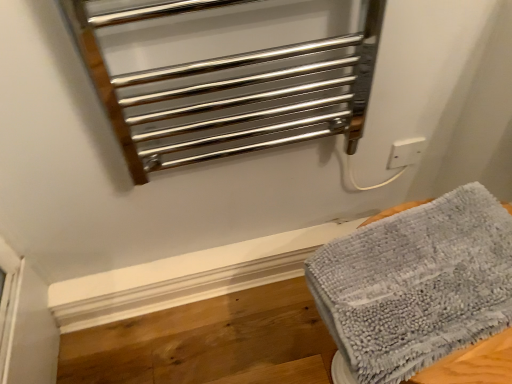
Describe the element at coordinates (406, 152) in the screenshot. I see `white plastic electric outlet at upper right` at that location.

The image size is (512, 384). What are the coordinates of `gray fluffy towel at lower right` in the screenshot? It's located at (416, 284).

From the image's perspective, who appears lower, white plastic electric outlet at upper right or gray fluffy towel at lower right?

gray fluffy towel at lower right, from the image's perspective.

In the scene shown: Which point is more forward, (402, 158) or (402, 235)?

Point (402, 235)

Is white plastic electric outlet at upper right oriented away from gray fluffy towel at lower right?

white plastic electric outlet at upper right is not turned away from gray fluffy towel at lower right.

From a real-world perspective, is white plastic electric outlet at upper right physically located above or below gray fluffy towel at lower right?

white plastic electric outlet at upper right is situated lower than gray fluffy towel at lower right in the real world.

Is gray fluffy towel at lower right to the left of polished metal towel rack at upper center from the viewer's perspective?

In fact, gray fluffy towel at lower right is to the right of polished metal towel rack at upper center.

Between gray fluffy towel at lower right and polished metal towel rack at upper center, which one has larger size?

Bigger between the two is polished metal towel rack at upper center.

How many degrees apart are the facing directions of gray fluffy towel at lower right and polished metal towel rack at upper center?

The angle between the facing direction of gray fluffy towel at lower right and the facing direction of polished metal towel rack at upper center is 84.6 degrees.

Is point (353, 237) more distant than point (209, 126)?

That is False.

From the image's perspective, is gray fluffy towel at lower right above or below white plastic electric outlet at upper right?

gray fluffy towel at lower right is below white plastic electric outlet at upper right.

Consider the image. Can you confirm if gray fluffy towel at lower right is smaller than white plastic electric outlet at upper right?

Incorrect, gray fluffy towel at lower right is not smaller in size than white plastic electric outlet at upper right.

Is gray fluffy towel at lower right positioned beyond the bounds of white plastic electric outlet at upper right?

Yes, gray fluffy towel at lower right is located beyond the bounds of white plastic electric outlet at upper right.

From a real-world perspective, is polished metal towel rack at upper center over gray fluffy towel at lower right?

Yes, from a real-world perspective, polished metal towel rack at upper center is over gray fluffy towel at lower right

Is polished metal towel rack at upper center looking in the opposite direction of gray fluffy towel at lower right?

No, gray fluffy towel at lower right is not at the back of polished metal towel rack at upper center.

Is polished metal towel rack at upper center taller or shorter than gray fluffy towel at lower right?

polished metal towel rack at upper center is taller than gray fluffy towel at lower right.

Is polished metal towel rack at upper center further to camera compared to gray fluffy towel at lower right?

No, it is in front of gray fluffy towel at lower right.

The width and height of the screenshot is (512, 384). Identify the location of electric outlet behind the polished metal towel rack at upper center. (406, 152).

Measure the distance between white plastic electric outlet at upper right and polished metal towel rack at upper center.

16.40 inches.

From a real-world perspective, relative to polished metal towel rack at upper center, is white plastic electric outlet at upper right vertically above or below?

white plastic electric outlet at upper right is situated lower than polished metal towel rack at upper center in the real world.

Which point is more distant from viewer, [413,146] or [361,53]?

Point [413,146]

This screenshot has height=384, width=512. I want to click on electric outlet on the right side of polished metal towel rack at upper center, so click(x=406, y=152).

How different are the orientations of polished metal towel rack at upper center and white plastic electric outlet at upper right in degrees?

The angular difference between polished metal towel rack at upper center and white plastic electric outlet at upper right is 3.38 degrees.

Is polished metal towel rack at upper center in contact with white plastic electric outlet at upper right?

They are not placed beside each other.

Is polished metal towel rack at upper center thinner than white plastic electric outlet at upper right?

In fact, polished metal towel rack at upper center might be wider than white plastic electric outlet at upper right.

The height and width of the screenshot is (384, 512). In order to click on electric outlet behind the gray fluffy towel at lower right in this screenshot , I will do `click(406, 152)`.

This screenshot has width=512, height=384. What are the coordinates of `cage located above the gray fluffy towel at lower right (from the image's perspective)` in the screenshot? It's located at (230, 91).

Considering their positions, is white plastic electric outlet at upper right positioned further to gray fluffy towel at lower right than polished metal towel rack at upper center?

Among the two, white plastic electric outlet at upper right is located further to gray fluffy towel at lower right.

Considering their positions, is gray fluffy towel at lower right positioned closer to white plastic electric outlet at upper right than polished metal towel rack at upper center?

The object closer to white plastic electric outlet at upper right is polished metal towel rack at upper center.

Which object lies further to the anchor point polished metal towel rack at upper center, gray fluffy towel at lower right or white plastic electric outlet at upper right?

white plastic electric outlet at upper right.

When comparing their distances from white plastic electric outlet at upper right, does polished metal towel rack at upper center or gray fluffy towel at lower right seem closer?

polished metal towel rack at upper center.

Estimate the real-world distances between objects in this image. Which object is closer to gray fluffy towel at lower right, polished metal towel rack at upper center or white plastic electric outlet at upper right?

polished metal towel rack at upper center.

From the image, which object appears to be farther from polished metal towel rack at upper center, white plastic electric outlet at upper right or gray fluffy towel at lower right?

white plastic electric outlet at upper right.

Find the location of `towel positioned between polished metal towel rack at upper center and white plastic electric outlet at upper right from near to far`. towel positioned between polished metal towel rack at upper center and white plastic electric outlet at upper right from near to far is located at coordinates (416, 284).